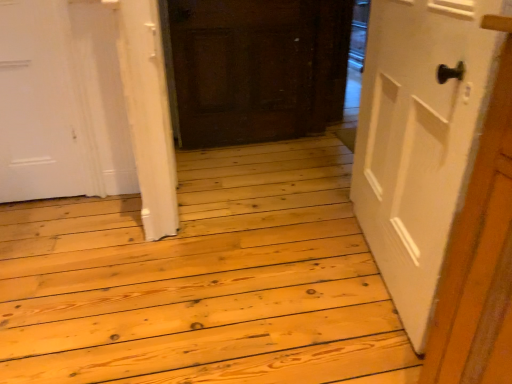
The width and height of the screenshot is (512, 384). What are the coordinates of `vacant space situated on the left part of white matte door at right, which is the 1th door in right-to-left order` in the screenshot? It's located at click(x=271, y=282).